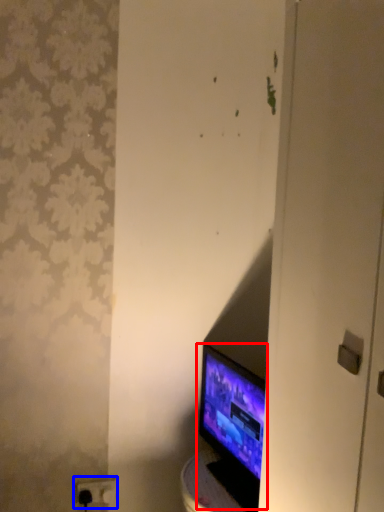
Question: Which point is closer to the camera, computer monitor (highlighted by a red box) or electric outlet (highlighted by a blue box)?

Choices:
 (A) computer monitor
 (B) electric outlet

Answer: (A)